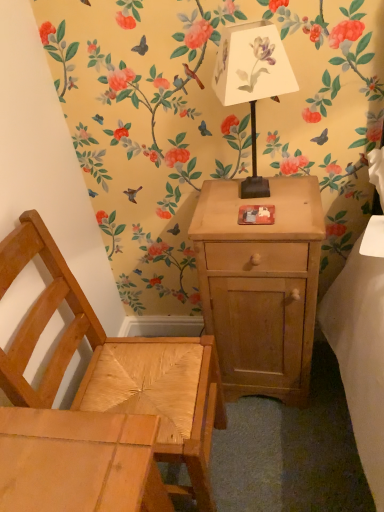
The image size is (384, 512). Find the location of `vacant space situated above light brown wood nightstand at center (from a real-world perspective)`. vacant space situated above light brown wood nightstand at center (from a real-world perspective) is located at coordinates (257, 204).